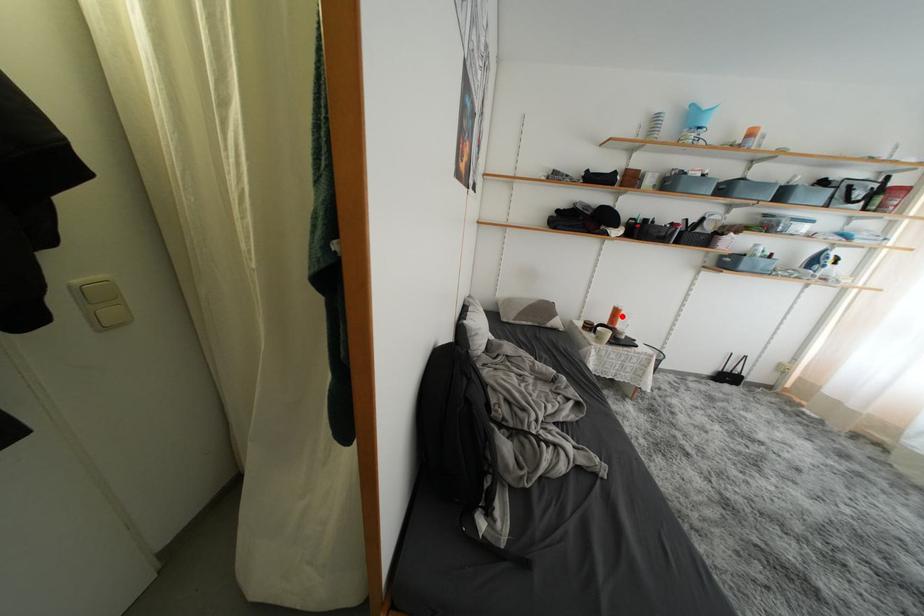
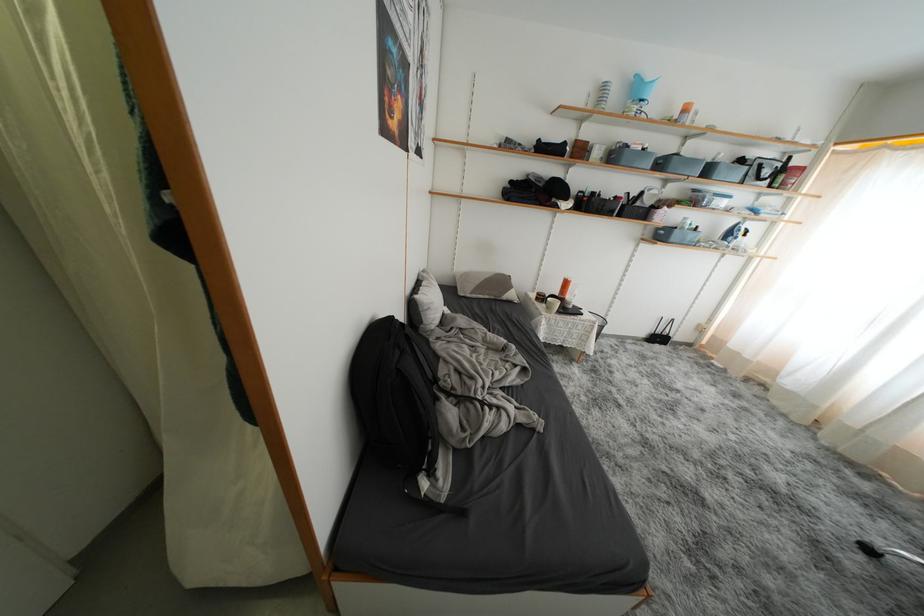
In the second image, find the point that corresponds to the highlighted location in the first image.

(572, 286)